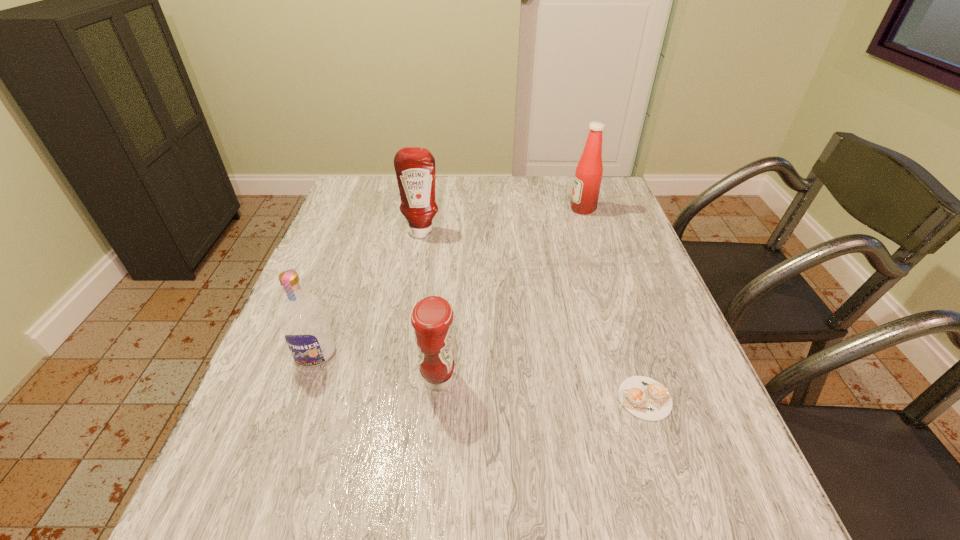
Where is `free spot that satisfies the following two spatial constraints: 1. on the front side of the second nearest condiment; 2. on the left side of the shortest object`? free spot that satisfies the following two spatial constraints: 1. on the front side of the second nearest condiment; 2. on the left side of the shortest object is located at coordinates (393, 399).